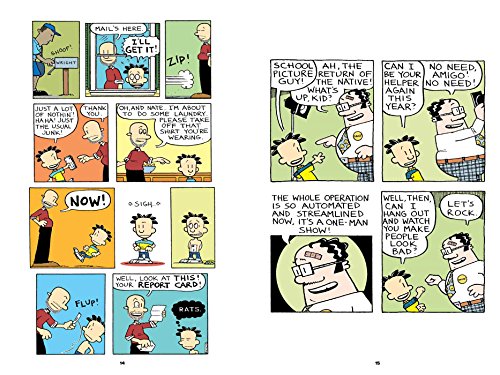
Image resolution: width=500 pixels, height=375 pixels. I want to click on box, so click(149, 45).